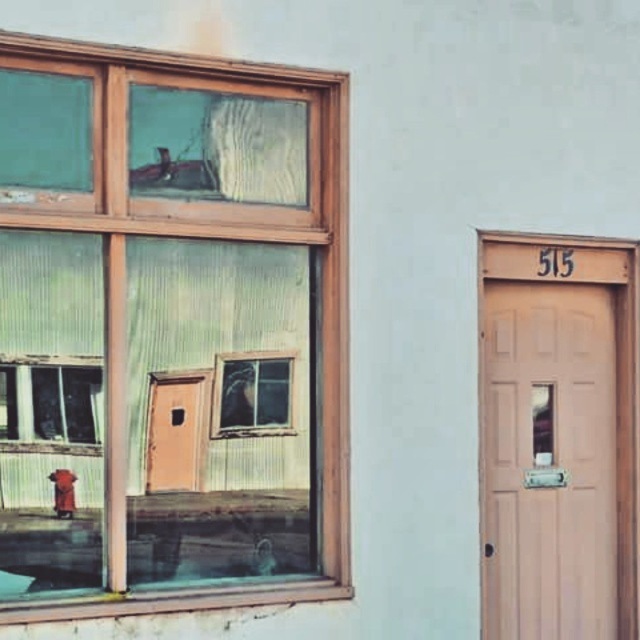
Question: Is clear glass window at upper left smaller than brass metallic hydrant at lower left?

Choices:
 (A) no
 (B) yes

Answer: (A)

Question: Estimate the real-world distances between objects in this image. Which object is closer to the matte wood door at right?

Choices:
 (A) clear glass window at upper left
 (B) brass metallic hydrant at lower left

Answer: (A)

Question: Is matte wood door at right above brass metallic hydrant at lower left?

Choices:
 (A) no
 (B) yes

Answer: (B)

Question: Does clear glass window at upper left have a larger size compared to matte wood door at right?

Choices:
 (A) yes
 (B) no

Answer: (A)

Question: Which point appears closest to the camera in this image?

Choices:
 (A) (10, 364)
 (B) (572, 598)

Answer: (A)

Question: Which point is farther from the camera taking this photo?

Choices:
 (A) (268, 566)
 (B) (65, 496)
 (C) (595, 406)

Answer: (C)